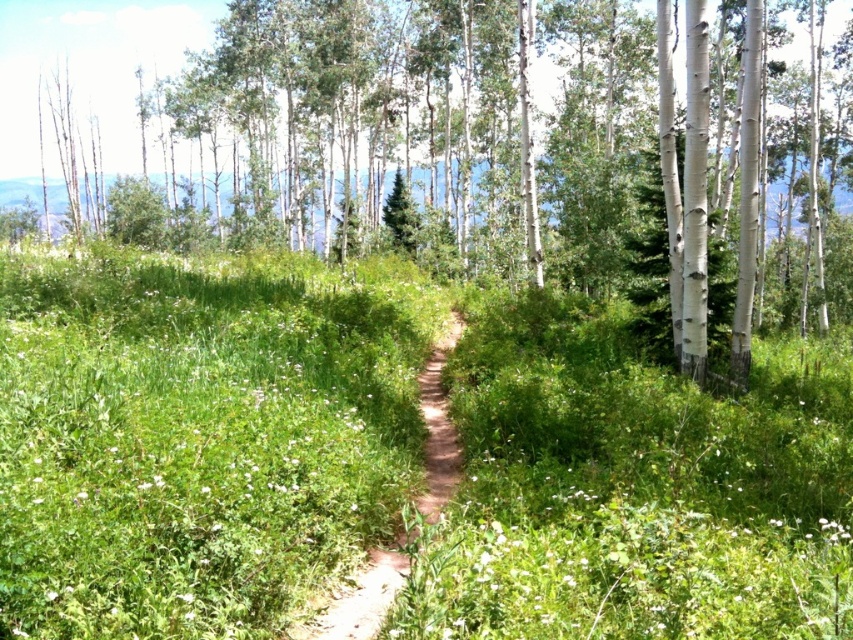
In the scene shown: You are a hiker trying to stay on the brown dirt path at center while avoiding the green grassy at center. Based on the scene, which direction should you turn to stay on the path?

The green grassy at center is wider than the brown dirt path at center, so you should turn towards the narrower area to stay on the brown dirt path at center.